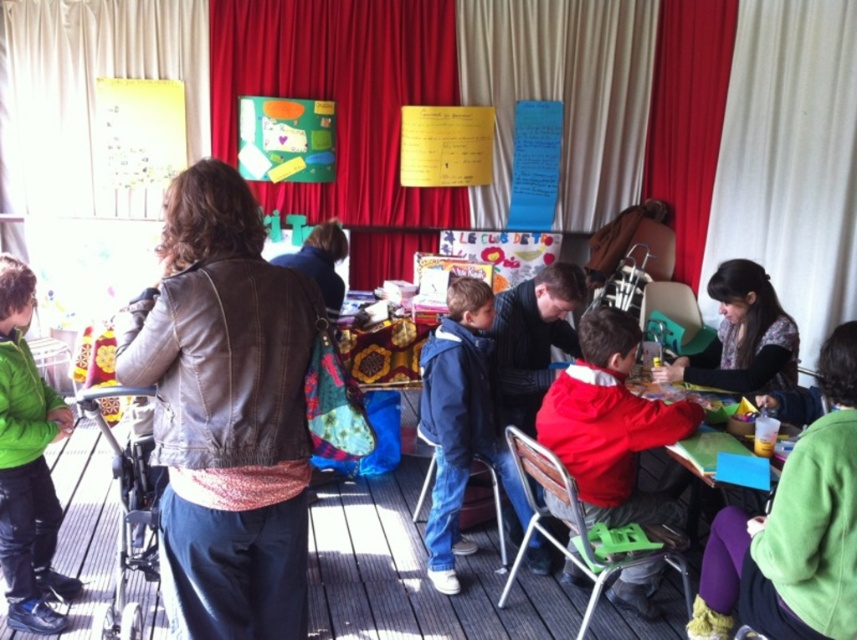
Does red matte jacket at center appear under dark brown leather jacket at lower right?

Yes.

Can you confirm if red matte jacket at center is smaller than dark brown leather jacket at lower right?

Actually, red matte jacket at center might be larger than dark brown leather jacket at lower right.

At what (x,y) coordinates should I click in order to perform the action: click on red matte jacket at center. Please return your answer as a coordinate pair (x, y). This screenshot has width=857, height=640. Looking at the image, I should click on (613, 426).

Is leather jacket at upper left closer to the viewer compared to green fabric chair at center?

Yes, it is.

Does point (264, 628) lie behind point (694, 310)?

No, (264, 628) is in front of (694, 310).

I want to click on leather jacket at upper left, so click(226, 412).

Does green puffy jacket at lower left have a lesser width compared to wooden chair at lower center?

Correct, green puffy jacket at lower left's width is less than wooden chair at lower center's.

The height and width of the screenshot is (640, 857). What do you see at coordinates (27, 465) in the screenshot? I see `green puffy jacket at lower left` at bounding box center [27, 465].

You are a GUI agent. You are given a task and a screenshot of the screen. Output one action in this format:
    pyautogui.click(x=<x>, y=<y>)
    Task: Click on the green puffy jacket at lower left
    The height and width of the screenshot is (640, 857).
    Given the screenshot: What is the action you would take?
    pyautogui.click(x=27, y=465)

Image resolution: width=857 pixels, height=640 pixels. Find the location of `green puffy jacket at lower left`. green puffy jacket at lower left is located at coordinates (27, 465).